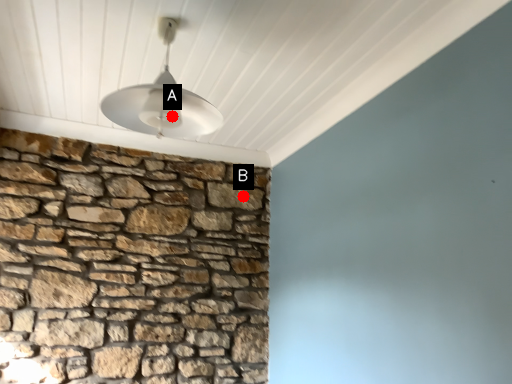
Question: Two points are circled on the image, labeled by A and B beside each circle. Which point is closer to the camera?

Choices:
 (A) A is closer
 (B) B is closer

Answer: (A)